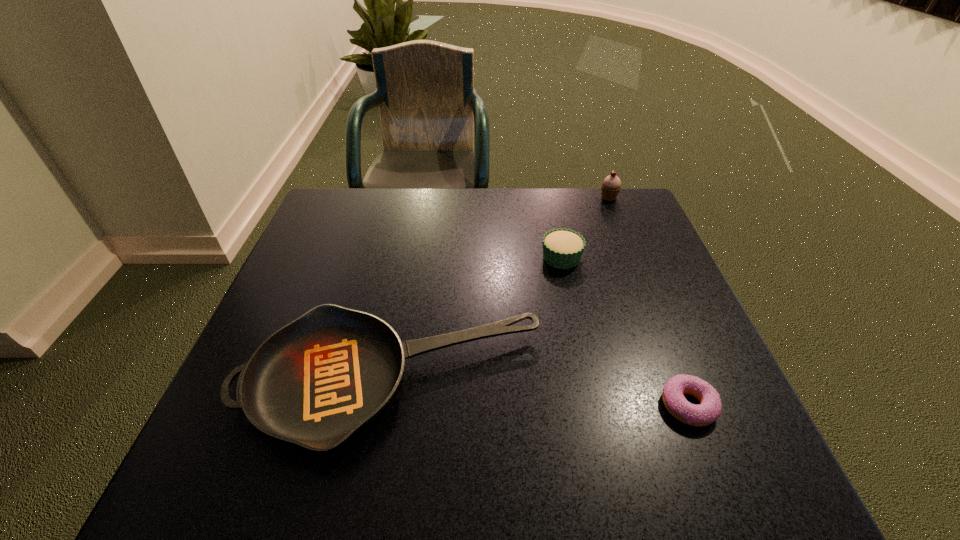
Image resolution: width=960 pixels, height=540 pixels. I want to click on free spot between the third nearest object and the leftmost object, so click(476, 320).

I want to click on free area in between the right cupcake and the second shortest object, so click(x=500, y=290).

The image size is (960, 540). Find the location of `free space between the shorter cupcake and the leftmost object`. free space between the shorter cupcake and the leftmost object is located at coordinates (476, 320).

The height and width of the screenshot is (540, 960). I want to click on free space between the leftmost object and the nearer cupcake, so click(x=476, y=320).

The height and width of the screenshot is (540, 960). I want to click on vacant space that is in between the doughnut and the farthest object, so click(649, 301).

The height and width of the screenshot is (540, 960). I want to click on the closest object to the leftmost object, so click(x=562, y=248).

Where is `the closest object relative to the tallest object`? The width and height of the screenshot is (960, 540). the closest object relative to the tallest object is located at coordinates (562, 248).

Identify the location of blank space that satisfies the following two spatial constraints: 1. on the back side of the frying pan; 2. on the left side of the right cupcake. (423, 197).

Locate an element on the screen. vacant area in the image that satisfies the following two spatial constraints: 1. on the back side of the nearer cupcake; 2. on the left side of the leftmost object is located at coordinates (413, 258).